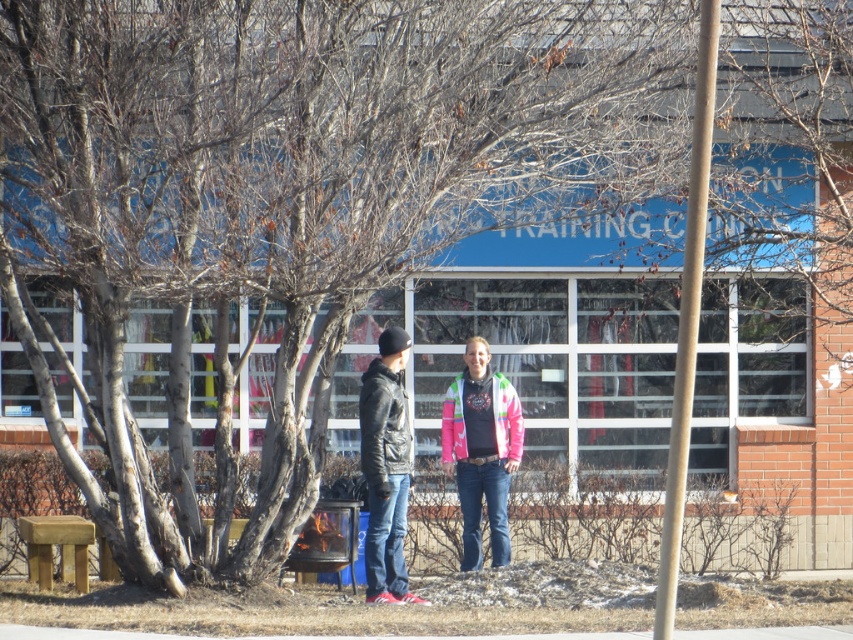
You are a photographer trying to capture both the pink fleece jacket at center and the leather jacket at center in a single frame. Based on their sizes, which jacket should you focus on to ensure both are visible without zooming in too much?

The pink fleece jacket at center is smaller than the leather jacket at center, so focusing on the leather jacket at center would allow both to be visible without excessive zooming.